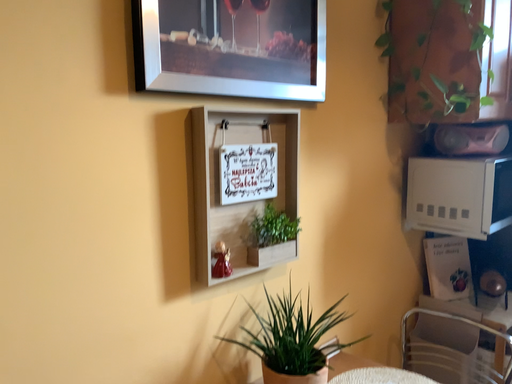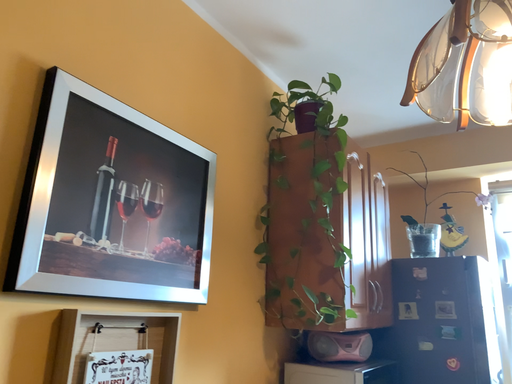
Question: How did the camera likely rotate when shooting the video?

Choices:
 (A) rotated upward
 (B) rotated downward

Answer: (A)